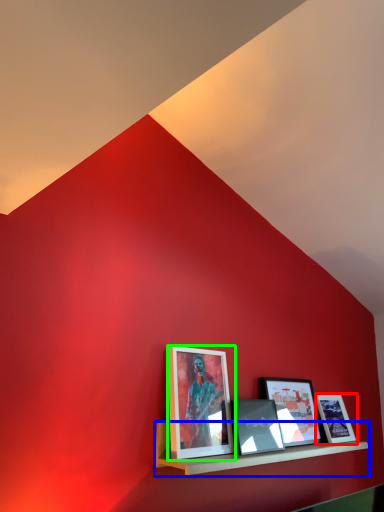
Question: Which is farther away from picture frame (highlighted by a red box)? shelf (highlighted by a blue box) or picture frame (highlighted by a green box)?

Choices:
 (A) shelf
 (B) picture frame

Answer: (B)